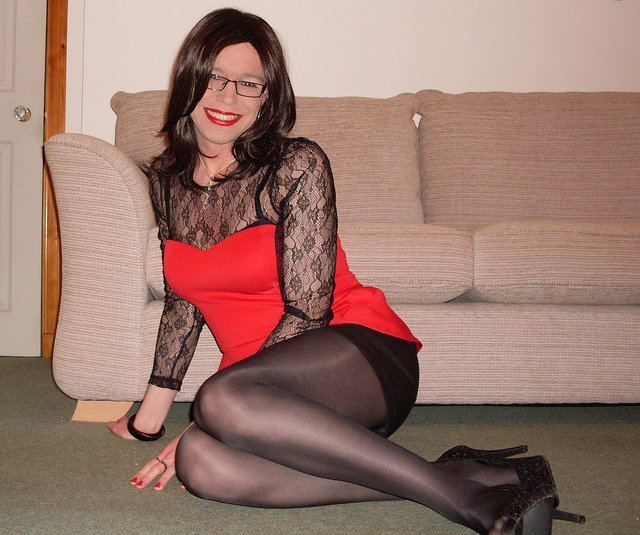
Image resolution: width=640 pixels, height=535 pixels. Find the location of `couch right leg`. couch right leg is located at coordinates tap(84, 408).